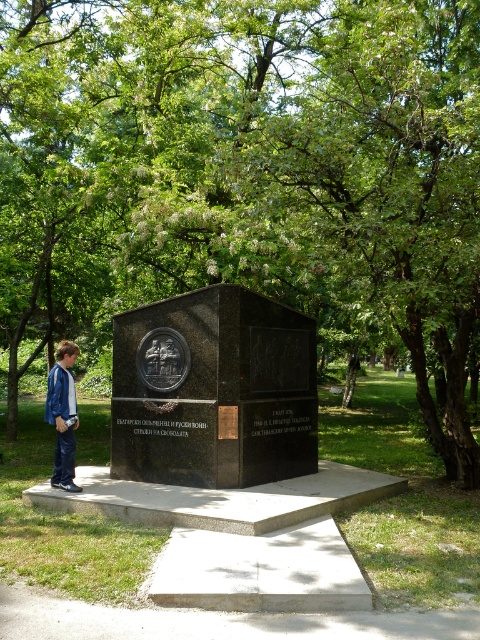
Can you confirm if black polished stone monument at center is smaller than blue denim jacket at lower left?

No, black polished stone monument at center is not smaller than blue denim jacket at lower left.

The height and width of the screenshot is (640, 480). I want to click on black polished stone monument at center, so click(214, 390).

Does point (265, 456) come farther from viewer compared to point (59, 461)?

Yes, point (265, 456) is behind point (59, 461).

The width and height of the screenshot is (480, 640). I want to click on black polished stone monument at center, so 214,390.